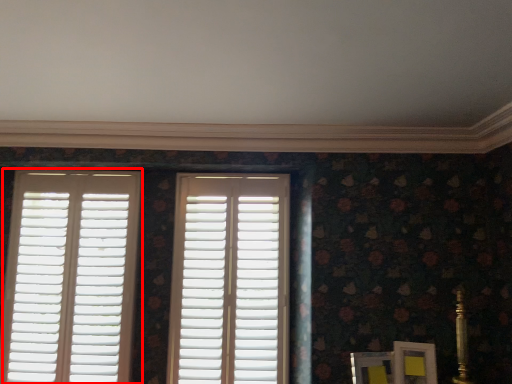
Question: From the image's perspective, considering the relative positions of window (annotated by the red box) and window in the image provided, where is window (annotated by the red box) located with respect to the staircase?

Choices:
 (A) above
 (B) below

Answer: (B)